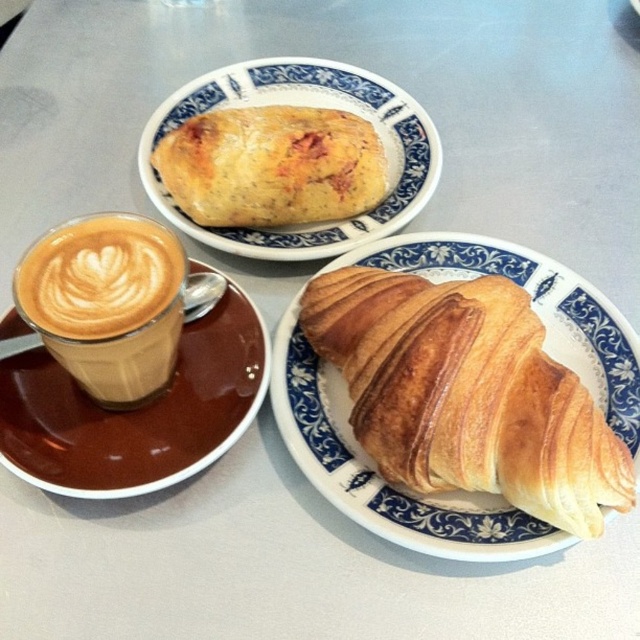
Between golden-brown crusty pastry at upper center and golden-brown flaky pastry at upper center, which one is positioned lower?

golden-brown flaky pastry at upper center is lower down.

Is golden-brown crusty pastry at upper center above golden-brown flaky pastry at upper center?

Yes, golden-brown crusty pastry at upper center is above golden-brown flaky pastry at upper center.

Is point (294, 61) closer to camera compared to point (358, 182)?

No.

The height and width of the screenshot is (640, 640). Identify the location of golden-brown crusty pastry at upper center. (310, 106).

Which is more to the left, golden-brown porcelain croissant at center-right or brown ceramic saucer at lower left?

From the viewer's perspective, brown ceramic saucer at lower left appears more on the left side.

Find the location of a particular element. golden-brown porcelain croissant at center-right is located at coordinates (378, 476).

Between point (339, 401) and point (64, 461), which one is positioned behind?

The point (339, 401) is more distant.

At what (x,y) coordinates should I click in order to perform the action: click on golden-brown porcelain croissant at center-right. Please return your answer as a coordinate pair (x, y). This screenshot has height=640, width=640. Looking at the image, I should click on (378, 476).

Does latte art coffee at left lie behind golden-brown crusty pastry at upper center?

No, latte art coffee at left is closer to the viewer.

Between point (113, 340) and point (232, 104), which one is positioned in front?

Point (113, 340)

Measure the distance between point (147, 268) and camera.

The distance of point (147, 268) from camera is 36.98 inches.

In order to click on latte art coffee at left in this screenshot , I will do `click(106, 301)`.